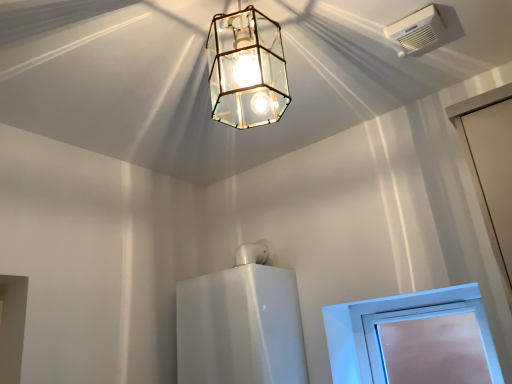
Question: Is white plastic window at lower right taller or shorter than clear glass lantern at upper center?

Choices:
 (A) tall
 (B) short

Answer: (B)

Question: Is white plastic window at lower right in front of or behind clear glass lantern at upper center in the image?

Choices:
 (A) front
 (B) behind

Answer: (B)

Question: Which of these objects is positioned closest to the clear glass lantern at upper center?

Choices:
 (A) white glossy water heater at center
 (B) white plastic air conditioning unit at upper right
 (C) white plastic window at lower right

Answer: (B)

Question: Based on their relative distances, which object is farther from the white glossy water heater at center?

Choices:
 (A) clear glass lantern at upper center
 (B) white plastic window at lower right
 (C) white plastic air conditioning unit at upper right

Answer: (C)